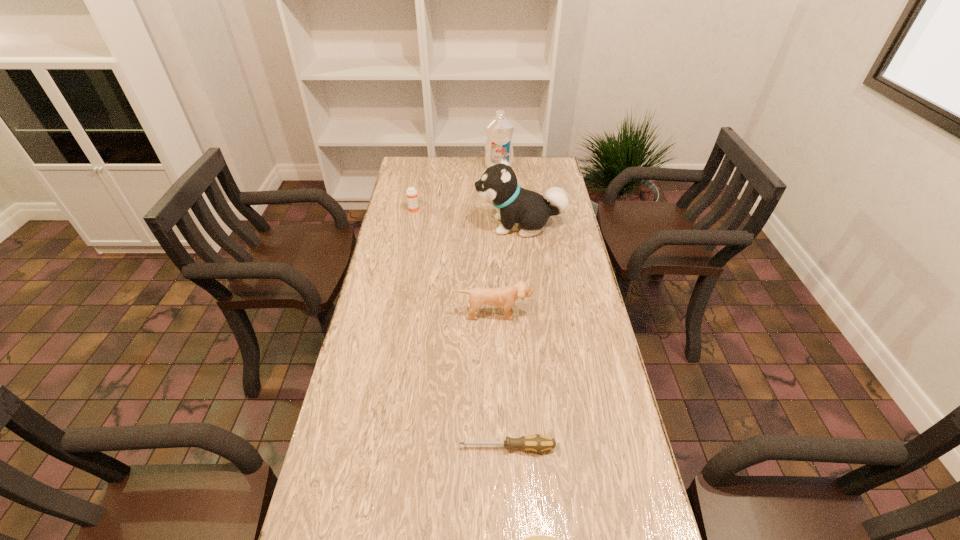
Find the location of a particular element. This screenshot has width=960, height=540. the farther puppy is located at coordinates (498, 185).

This screenshot has height=540, width=960. I want to click on detergent, so click(x=499, y=130).

This screenshot has height=540, width=960. Identify the location of the nearer puppy. (505, 296).

You are a GUI agent. You are given a task and a screenshot of the screen. Output one action in this format:
    pyautogui.click(x=<x>, y=<y>)
    Task: Click on the shorter puppy
    The height and width of the screenshot is (540, 960).
    Given the screenshot: What is the action you would take?
    pyautogui.click(x=505, y=296)

Locate an element on the screen. This screenshot has width=960, height=540. medicine is located at coordinates (412, 199).

Identify the location of the shortest object. The width and height of the screenshot is (960, 540). (538, 443).

The height and width of the screenshot is (540, 960). In order to click on the fifth farthest object in this screenshot , I will do `click(538, 443)`.

What are the coordinates of `vacant space located 0.240m at the face of the taller puppy` in the screenshot? It's located at (414, 225).

Image resolution: width=960 pixels, height=540 pixels. Find the location of `free space located 0.270m at the face of the taller puppy`. free space located 0.270m at the face of the taller puppy is located at coordinates click(x=406, y=225).

This screenshot has height=540, width=960. I want to click on free space located 0.270m at the face of the taller puppy, so click(x=406, y=225).